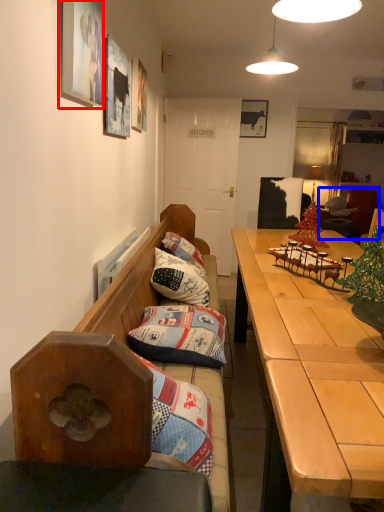
Question: Which of the following is the closest to the observer, picture frame (highlighted by a red box) or bean bag chair (highlighted by a blue box)?

Choices:
 (A) picture frame
 (B) bean bag chair

Answer: (A)